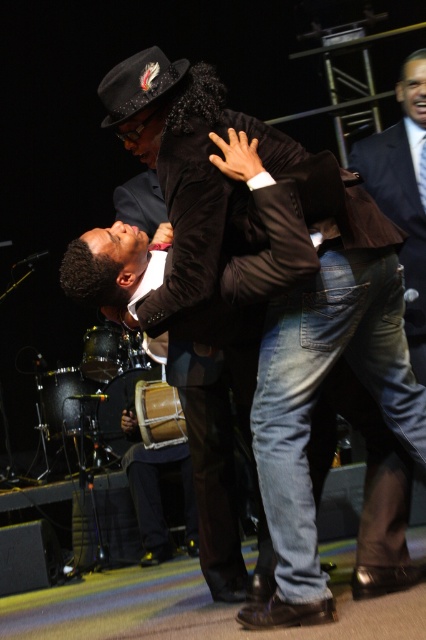
Question: Does black leather jacket at center lie in front of wooden drum at center?

Choices:
 (A) yes
 (B) no

Answer: (A)

Question: In this image, where is black leather jacket at center located relative to dark brown suit at upper right?

Choices:
 (A) right
 (B) left

Answer: (B)

Question: Which object is positioned closest to the black leather jacket at center?

Choices:
 (A) dark brown suit at upper right
 (B) wooden drum at center

Answer: (A)

Question: Does dark brown suit at upper right have a greater width compared to wooden drum at center?

Choices:
 (A) no
 (B) yes

Answer: (A)

Question: Among these objects, which one is farthest from the camera?

Choices:
 (A) wooden drum at center
 (B) dark brown suit at upper right
 (C) black leather jacket at center

Answer: (A)

Question: Which point is farther to the camera?

Choices:
 (A) black leather jacket at center
 (B) dark brown suit at upper right

Answer: (B)